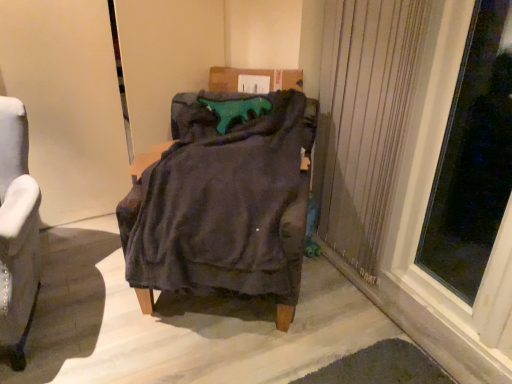
Question: Is beige textured curtain at right positioned beyond the bounds of transparent glass window at right?

Choices:
 (A) yes
 (B) no

Answer: (A)

Question: Is transparent glass window at right inside beige textured curtain at right?

Choices:
 (A) yes
 (B) no

Answer: (B)

Question: From a real-world perspective, is beige textured curtain at right under transparent glass window at right?

Choices:
 (A) yes
 (B) no

Answer: (A)

Question: Is beige textured curtain at right positioned with its back to transparent glass window at right?

Choices:
 (A) no
 (B) yes

Answer: (A)

Question: From a real-world perspective, is beige textured curtain at right on transparent glass window at right?

Choices:
 (A) no
 (B) yes

Answer: (A)

Question: Would you say velvet gray armchair at left is inside or outside velvet dark gray armchair at center?

Choices:
 (A) outside
 (B) inside

Answer: (A)

Question: Considering the positions of velvet gray armchair at left and velvet dark gray armchair at center in the image, is velvet gray armchair at left taller or shorter than velvet dark gray armchair at center?

Choices:
 (A) short
 (B) tall

Answer: (B)

Question: Is velvet gray armchair at left in front of or behind velvet dark gray armchair at center in the image?

Choices:
 (A) front
 (B) behind

Answer: (A)

Question: From the image's perspective, relative to velvet dark gray armchair at center, is velvet gray armchair at left above or below?

Choices:
 (A) below
 (B) above

Answer: (A)

Question: From a real-world perspective, is beige textured curtain at right above or below velvet dark gray armchair at center?

Choices:
 (A) above
 (B) below

Answer: (A)

Question: Is beige textured curtain at right in front of or behind velvet dark gray armchair at center in the image?

Choices:
 (A) front
 (B) behind

Answer: (B)

Question: In terms of height, does beige textured curtain at right look taller or shorter compared to velvet dark gray armchair at center?

Choices:
 (A) short
 (B) tall

Answer: (B)

Question: Is beige textured curtain at right inside the boundaries of velvet dark gray armchair at center, or outside?

Choices:
 (A) inside
 (B) outside

Answer: (B)

Question: From a real-world perspective, is transparent glass window at right physically located above or below velvet dark gray armchair at center?

Choices:
 (A) below
 (B) above

Answer: (B)

Question: Considering the positions of transparent glass window at right and velvet dark gray armchair at center in the image, is transparent glass window at right taller or shorter than velvet dark gray armchair at center?

Choices:
 (A) short
 (B) tall

Answer: (B)